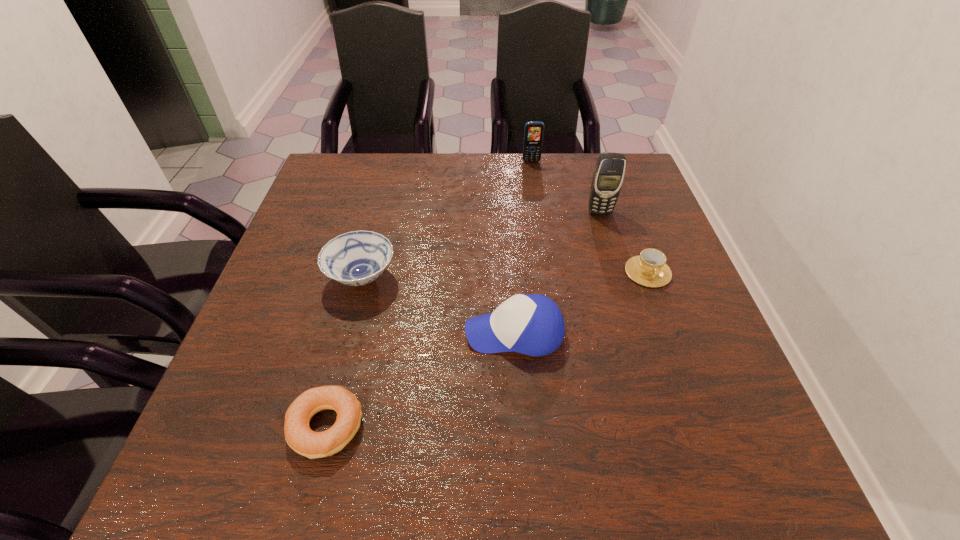
You are a GUI agent. You are given a task and a screenshot of the screen. Output one action in this format:
    pyautogui.click(x=<x>, y=<y>)
    Task: Click on the free point located on the front-facing side of the fifth farthest object
    
    Given the screenshot: What is the action you would take?
    coord(297,333)

Identify the location of blank space located on the front-facing side of the fifth farthest object. (391, 333).

This screenshot has width=960, height=540. I want to click on free space located 0.280m on the front-facing side of the fifth farthest object, so click(x=326, y=333).

At what (x,y) coordinates should I click in order to perform the action: click on free region located 0.270m on the right of the soup bowl. Please return your answer as a coordinate pair (x, y). The height and width of the screenshot is (540, 960). Looking at the image, I should click on (516, 278).

At what (x,y) coordinates should I click in order to perform the action: click on vacant space located 0.220m with the handle on the side of the cup. Please return your answer as a coordinate pair (x, y). The image size is (960, 540). Looking at the image, I should click on (686, 375).

Identify the location of vacant area situated 0.170m on the back of the bagel. The image size is (960, 540). (353, 319).

This screenshot has height=540, width=960. What are the coordinates of `object at the far edge` in the screenshot? It's located at (533, 133).

In order to click on object located at the near edge in this screenshot , I will do `click(298, 435)`.

Find the location of `soup bowl situated at the left edge`. soup bowl situated at the left edge is located at coordinates (356, 258).

What are the coordinates of `bagel present at the left edge` in the screenshot? It's located at (298, 435).